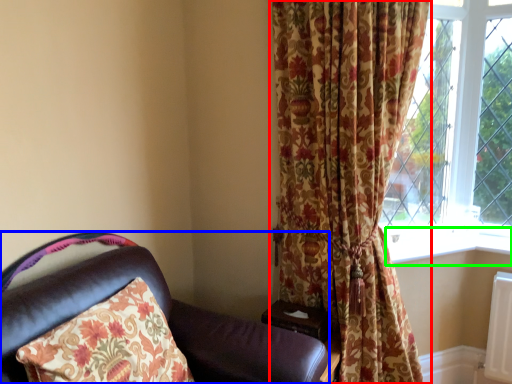
Question: Based on their relative distances, which object is farther from curtain (highlighted by a red box)? Choose from chair (highlighted by a blue box) and window sill (highlighted by a green box).

Choices:
 (A) chair
 (B) window sill

Answer: (A)